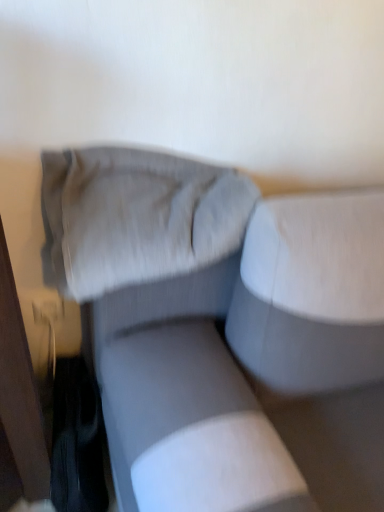
Question: Does suede-like gray pillow at upper center have a larger size compared to textured gray couch at center?

Choices:
 (A) yes
 (B) no

Answer: (B)

Question: Does suede-like gray pillow at upper center have a smaller size compared to textured gray couch at center?

Choices:
 (A) no
 (B) yes

Answer: (B)

Question: Considering the relative positions of suede-like gray pillow at upper center and textured gray couch at center in the image provided, is suede-like gray pillow at upper center to the left of textured gray couch at center from the viewer's perspective?

Choices:
 (A) no
 (B) yes

Answer: (B)

Question: Is suede-like gray pillow at upper center oriented towards textured gray couch at center?

Choices:
 (A) no
 (B) yes

Answer: (B)

Question: Can textured gray couch at center be found inside suede-like gray pillow at upper center?

Choices:
 (A) no
 (B) yes

Answer: (A)

Question: Can you see suede-like gray pillow at upper center touching textured gray couch at center?

Choices:
 (A) no
 (B) yes

Answer: (B)

Question: Does textured gray couch at center appear on the left side of suede-like gray pillow at upper center?

Choices:
 (A) yes
 (B) no

Answer: (B)

Question: Is textured gray couch at center further to camera compared to suede-like gray pillow at upper center?

Choices:
 (A) no
 (B) yes

Answer: (A)

Question: From a real-world perspective, is textured gray couch at center physically below suede-like gray pillow at upper center?

Choices:
 (A) yes
 (B) no

Answer: (A)

Question: Are textured gray couch at center and suede-like gray pillow at upper center far apart?

Choices:
 (A) yes
 (B) no

Answer: (B)

Question: From the image's perspective, is textured gray couch at center over suede-like gray pillow at upper center?

Choices:
 (A) no
 (B) yes

Answer: (A)

Question: Can you confirm if textured gray couch at center is wider than suede-like gray pillow at upper center?

Choices:
 (A) no
 (B) yes

Answer: (B)

Question: Visually, is suede-like gray pillow at upper center positioned to the left or to the right of textured gray couch at center?

Choices:
 (A) right
 (B) left

Answer: (B)